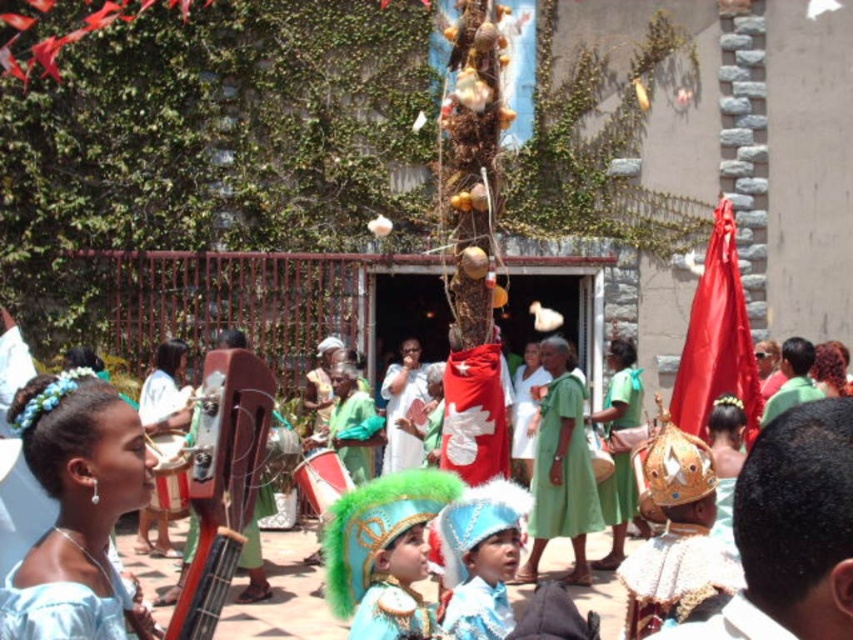
Question: Based on their relative distances, which object is nearer to the blue satin headdress at center?

Choices:
 (A) light blue satin dress at center
 (B) shiny red drum at center
 (C) green cotton dress at center

Answer: (B)

Question: Is blue satin headdress at center thinner than green cotton dress at center?

Choices:
 (A) no
 (B) yes

Answer: (B)

Question: Does light blue satin dress at center have a lesser width compared to green cotton dress at center?

Choices:
 (A) no
 (B) yes

Answer: (A)

Question: Which object is farther from the camera taking this photo?

Choices:
 (A) shiny red drum at center
 (B) green cotton dress at center
 (C) blue satin headdress at center

Answer: (B)

Question: Which point is farther from the camera taking this photo?

Choices:
 (A) (242, 580)
 (B) (85, 472)
 (C) (567, 401)

Answer: (C)

Question: Is the position of light blue satin dress at center less distant than that of blue satin headdress at center?

Choices:
 (A) no
 (B) yes

Answer: (B)